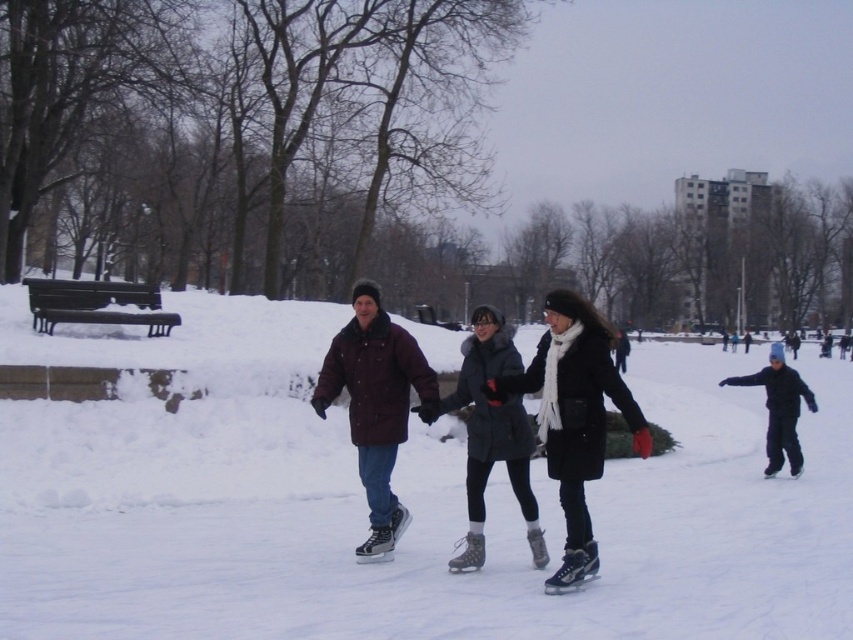
Between black matte coat at center and black matte jacket at lower right, which one appears on the left side from the viewer's perspective?

black matte coat at center is more to the left.

Can you confirm if black matte coat at center is wider than black matte jacket at lower right?

No, black matte coat at center is not wider than black matte jacket at lower right.

What do you see at coordinates (573, 417) in the screenshot? I see `black matte coat at center` at bounding box center [573, 417].

You are a GUI agent. You are given a task and a screenshot of the screen. Output one action in this format:
    pyautogui.click(x=<x>, y=<y>)
    Task: Click on the black matte coat at center
    Image resolution: width=853 pixels, height=640 pixels.
    Given the screenshot: What is the action you would take?
    coord(573,417)

Is point (630, 420) closer to viewer compared to point (386, 419)?

Yes, it is.

Find the location of a particular element. This screenshot has height=640, width=853. black matte coat at center is located at coordinates (573, 417).

Where is `black matte coat at center`? This screenshot has width=853, height=640. black matte coat at center is located at coordinates (573, 417).

Who is higher up, maroon woolen jacket at center or black matte jacket at lower right?

maroon woolen jacket at center is higher up.

Between maroon woolen jacket at center and black matte jacket at lower right, which one appears on the right side from the viewer's perspective?

From the viewer's perspective, black matte jacket at lower right appears more on the right side.

I want to click on maroon woolen jacket at center, so click(375, 403).

Locate an element on the screen. maroon woolen jacket at center is located at coordinates (375, 403).